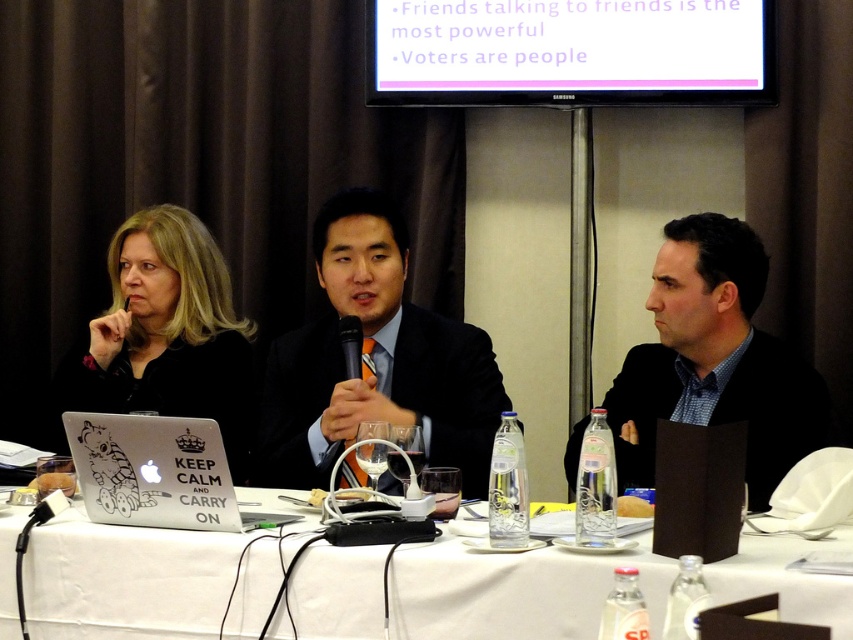
Between point (448, 358) and point (107, 499), which one is positioned in front?

Positioned in front is point (107, 499).

Who is more distant from viewer, (473, 362) or (152, 486)?

The point (473, 362) is more distant.

At what (x,y) coordinates should I click in order to perform the action: click on matte black suit at center. Please return your answer as a coordinate pair (x, y). Looking at the image, I should click on (375, 360).

Image resolution: width=853 pixels, height=640 pixels. Identify the location of white fabric table at center. (126, 579).

Does point (525, 580) come closer to viewer compared to point (276, 442)?

Yes.

Between point (189, 570) and point (289, 436), which one is positioned behind?

Point (289, 436)

You are a GUI agent. You are given a task and a screenshot of the screen. Output one action in this format:
    pyautogui.click(x=<x>, y=<y>)
    Task: Click on the white fabric table at center
    The height and width of the screenshot is (640, 853).
    Given the screenshot: What is the action you would take?
    pyautogui.click(x=126, y=579)

Who is positioned more to the left, black matte laptop at left or white matte laptop at lower left?

Positioned to the left is black matte laptop at left.

Can you confirm if black matte laptop at left is positioned to the right of white matte laptop at lower left?

Incorrect, black matte laptop at left is not on the right side of white matte laptop at lower left.

Identify the location of black matte laptop at left. (167, 333).

You are a GUI agent. You are given a task and a screenshot of the screen. Output one action in this format:
    pyautogui.click(x=<x>, y=<y>)
    Task: Click on the black matte laptop at left
    The image size is (853, 640).
    Given the screenshot: What is the action you would take?
    pyautogui.click(x=167, y=333)